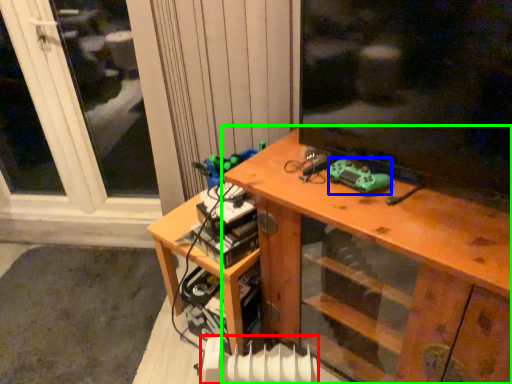
Question: Which object is the farthest from radiator (highlighted by a red box)? Choose among these: equipment (highlighted by a blue box) or desk (highlighted by a green box).

Choices:
 (A) equipment
 (B) desk

Answer: (A)